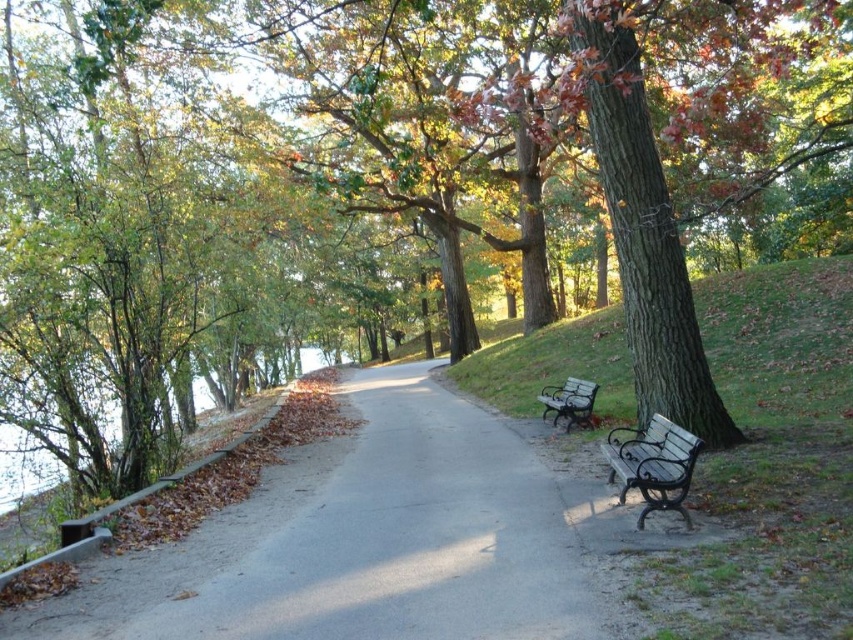
Question: Can you confirm if green leafy water at left is smaller than metallic brown bench at center?

Choices:
 (A) yes
 (B) no

Answer: (B)

Question: Which object is the farthest from the wooden park bench at lower right?

Choices:
 (A) metallic brown bench at center
 (B) brown rough bark tree at center-right
 (C) green leafy water at left
 (D) gray asphalt path at center

Answer: (C)

Question: Does wooden park bench at lower right have a larger size compared to green leafy water at left?

Choices:
 (A) yes
 (B) no

Answer: (B)

Question: Is gray asphalt path at center positioned behind wooden park bench at lower right?

Choices:
 (A) yes
 (B) no

Answer: (B)

Question: Which point is farther from the camera taking this photo?

Choices:
 (A) (647, 506)
 (B) (579, 424)
 (C) (4, 433)
 (D) (397, 625)

Answer: (B)

Question: Which of the following is the farthest from the observer?

Choices:
 (A) [7, 509]
 (B) [590, 381]
 (C) [648, 330]
 (D) [335, 632]

Answer: (B)